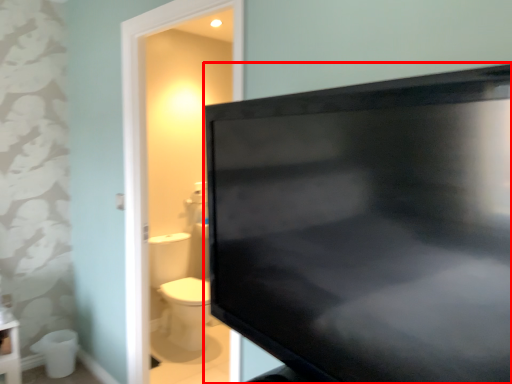
Question: From the image's perspective, what is the correct spatial relationship of television (annotated by the red box) in relation to toilet bowl?

Choices:
 (A) below
 (B) above

Answer: (B)